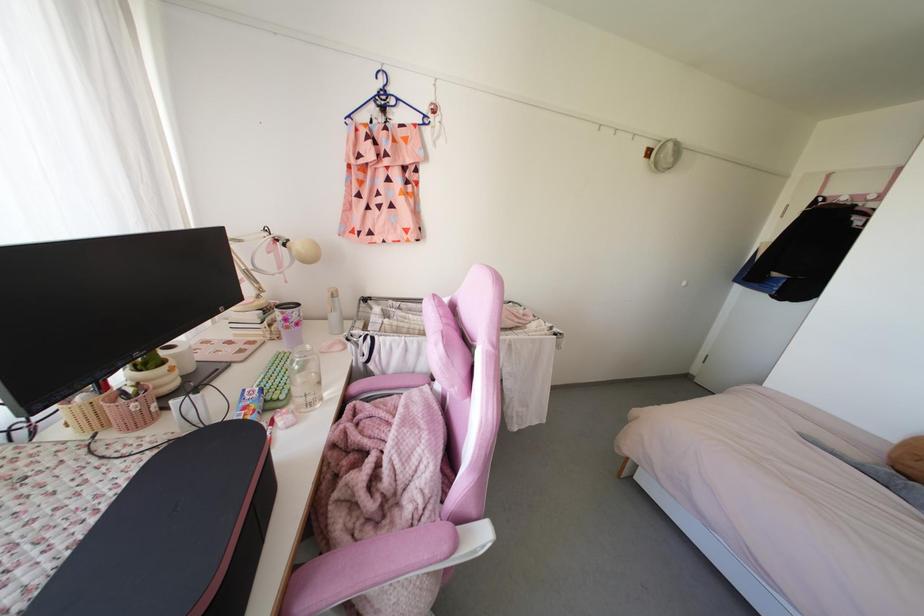
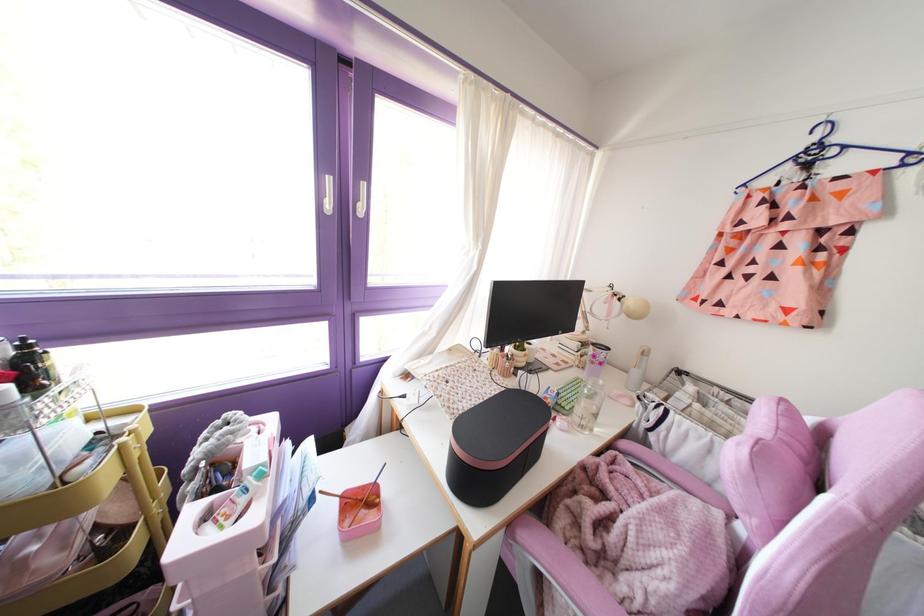
The point at (307, 346) is marked in the first image. Where is the corresponding point in the second image?

(601, 382)